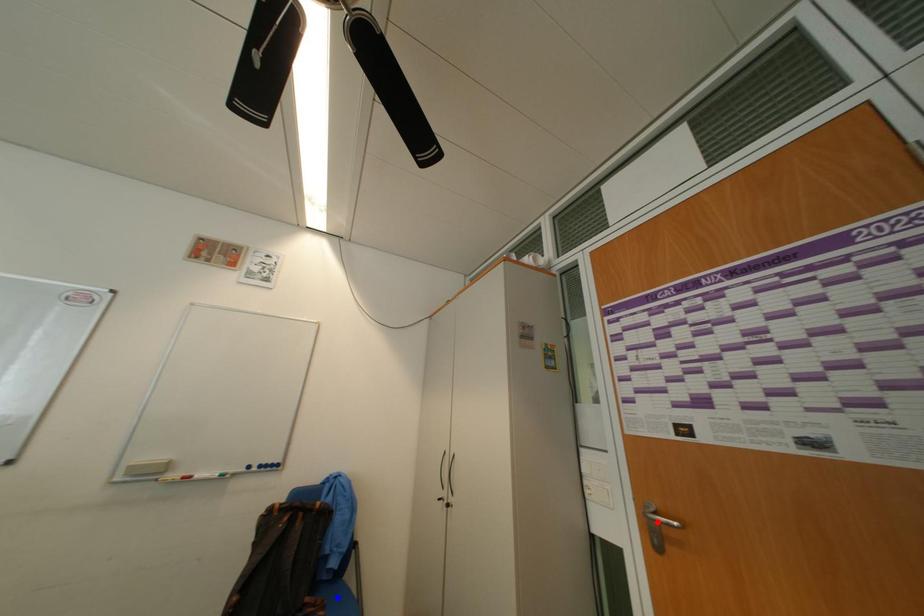
Question: In the image, two points are highlighted. Which point is nearer to the camera? Reply with the corresponding letter.

Choices:
 (A) blue point
 (B) red point

Answer: (B)